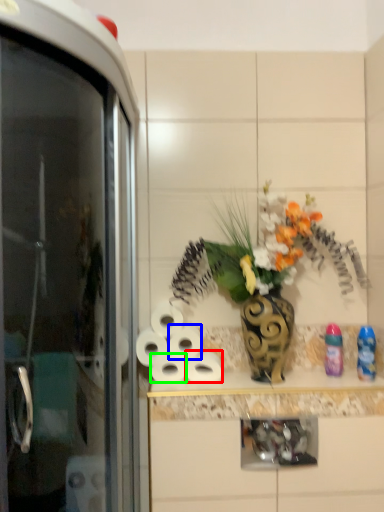
Question: Considering the real-world distances, which object is closest to toilet paper (highlighted by a red box)? toilet paper (highlighted by a blue box) or toilet paper (highlighted by a green box).

Choices:
 (A) toilet paper
 (B) toilet paper

Answer: (A)